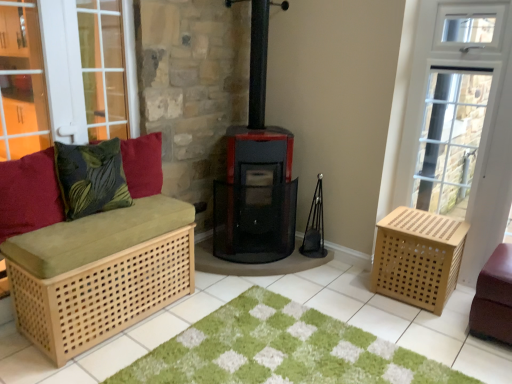
I want to click on vacant space in front of green leafy fabric pillow at left, placed as the 2th pillow when sorted from right to left, so click(x=84, y=232).